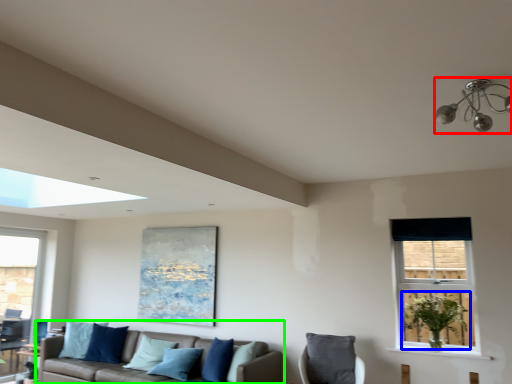
Question: Which object is positioned closest to light fixture (highlighted by a red box)? Select from plant (highlighted by a blue box) and studio couch (highlighted by a green box).

Choices:
 (A) plant
 (B) studio couch

Answer: (A)